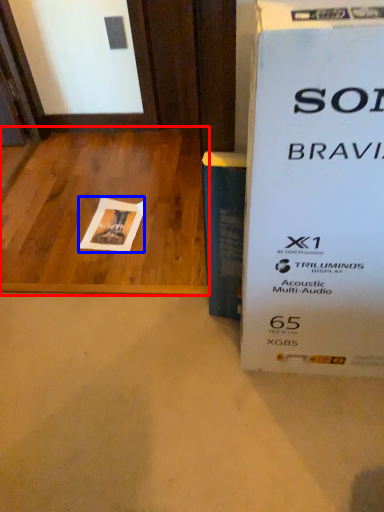
Question: Which point is further to the camera, table (highlighted by a red box) or flyer (highlighted by a blue box)?

Choices:
 (A) table
 (B) flyer

Answer: (B)